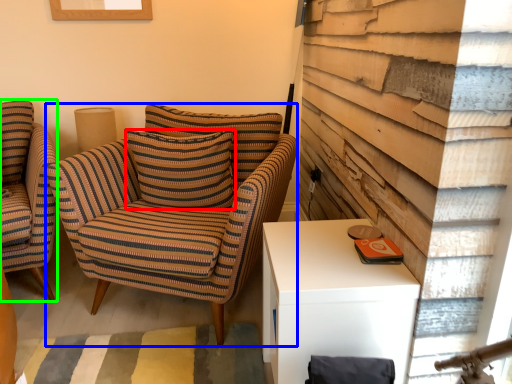
Question: Which object is the closest to the pillow (highlighted by a red box)? Choose among these: chair (highlighted by a blue box) or chair (highlighted by a green box).

Choices:
 (A) chair
 (B) chair

Answer: (A)